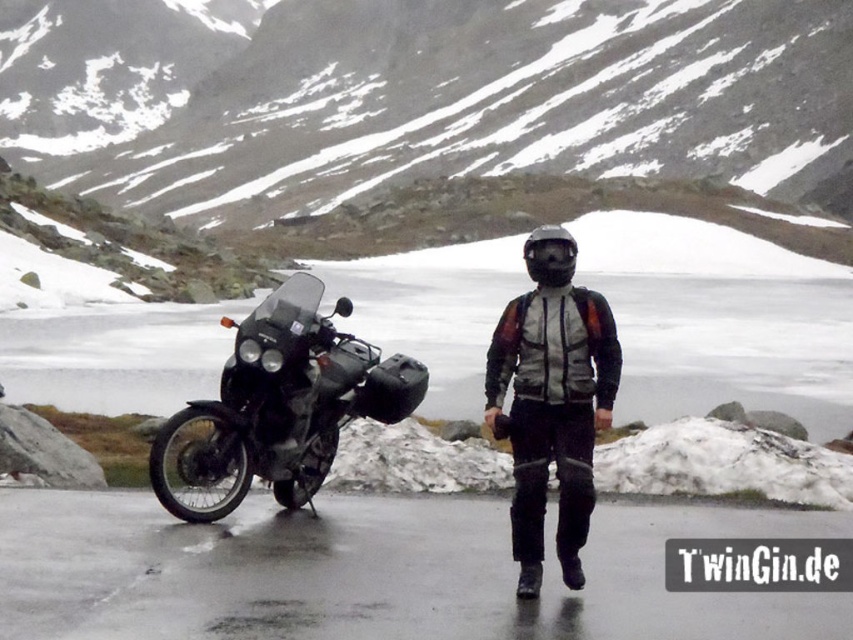
Does snowy rock at center appear on the right side of matte black jacket at center?

In fact, snowy rock at center is to the left of matte black jacket at center.

Between snowy rock at center and matte black jacket at center, which one is positioned lower?

matte black jacket at center

Locate an element on the screen. The width and height of the screenshot is (853, 640). snowy rock at center is located at coordinates (415, 96).

Based on the photo, between snowy rock at center and matte black motorcycle at left, which one appears on the left side from the viewer's perspective?

snowy rock at center

Can you confirm if snowy rock at center is shorter than matte black motorcycle at left?

No, snowy rock at center is not shorter than matte black motorcycle at left.

Identify the location of snowy rock at center. (415, 96).

Does point (239, 412) come closer to viewer compared to point (538, 406)?

No, it is not.

Which is above, matte black motorcycle at left or matte black jacket at center?

matte black jacket at center is higher up.

Identify the location of matte black motorcycle at left. (282, 403).

Identify the location of matte black motorcycle at left. This screenshot has height=640, width=853. (282, 403).